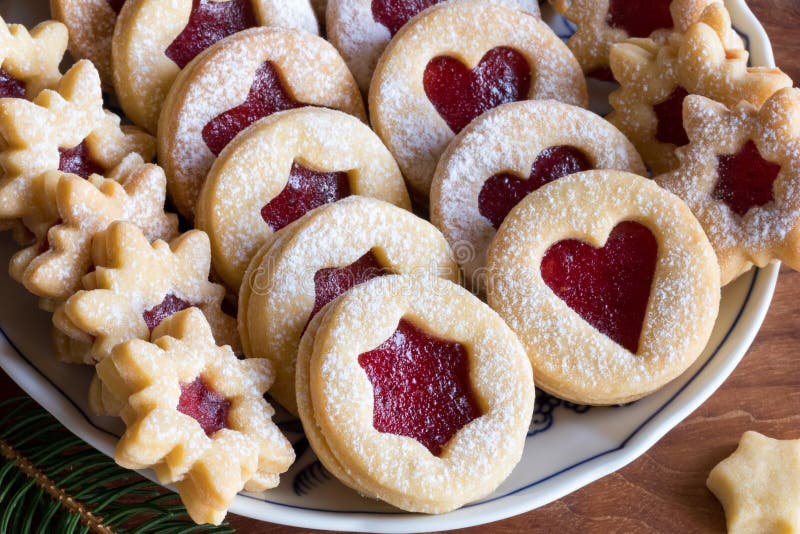
The height and width of the screenshot is (534, 800). I want to click on plate, so click(x=549, y=470), click(x=733, y=329), click(x=762, y=47), click(x=46, y=400).